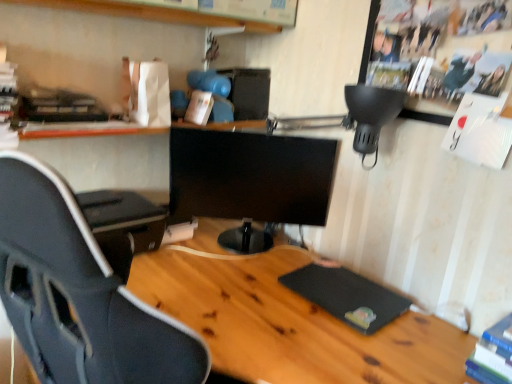
Question: In the image, is black glossy monitor at center on the left side or the right side of blue hardcover book at lower right, marked as the first book in a right-to-left arrangement?

Choices:
 (A) left
 (B) right

Answer: (A)

Question: Is black glossy monitor at center wider or thinner than blue hardcover book at lower right, the 2th book viewed from the back?

Choices:
 (A) thin
 (B) wide

Answer: (A)

Question: Which object is the farthest from the blue hardcover book at lower right, marked as the first book in a right-to-left arrangement?

Choices:
 (A) wooden desk at center
 (B) black glossy monitor at center
 (C) wooden shelf at upper center
 (D) white matte book at upper center, the second book when ordered from front to back
 (E) black rubber mousepad at lower right

Answer: (C)

Question: Estimate the real-world distances between objects in this image. Which object is closer to the black rubber mousepad at lower right?

Choices:
 (A) white matte book at upper center, which is the 1th book from back to front
 (B) blue hardcover book at lower right, which appears as the 2th book when viewed from the left
 (C) black glossy monitor at center
 (D) wooden desk at center
 (E) wooden shelf at upper center

Answer: (D)